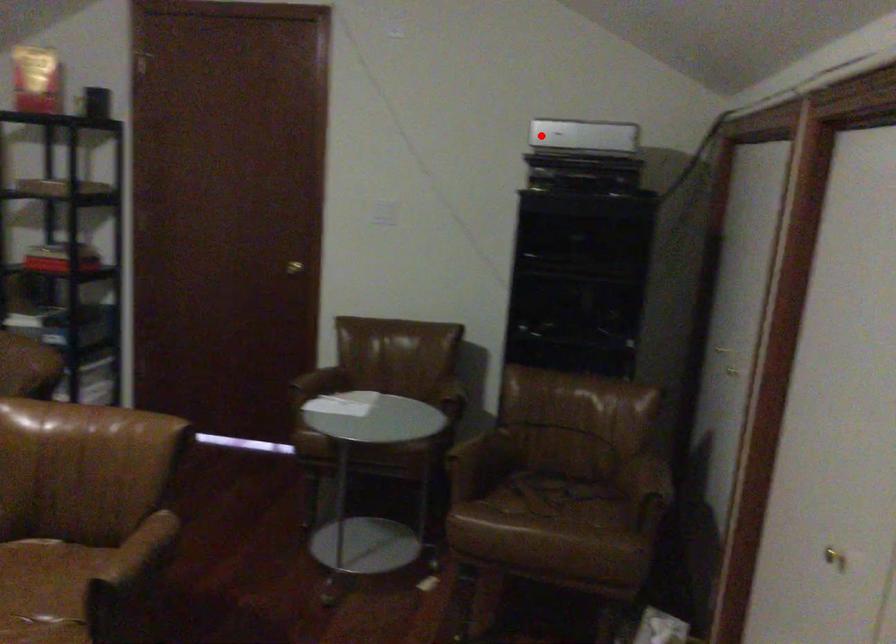
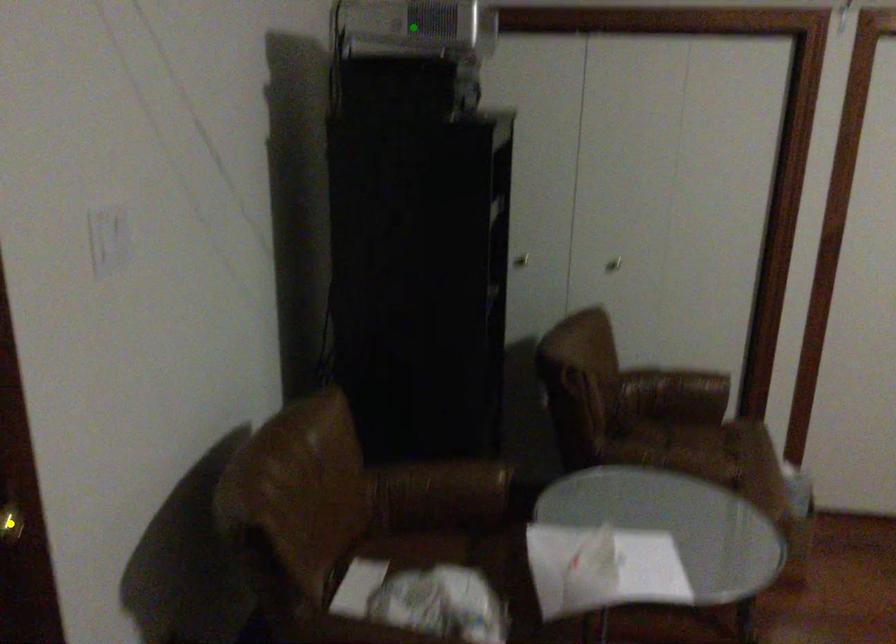
Question: I am providing you with two images of the same scene from different viewpoints. A red point is marked on the first image. You are given multiple points on the second image. Which point in image 2 represents the same 3d spot as the red point in image 1?

Choices:
 (A) blue point
 (B) yellow point
 (C) green point

Answer: (C)